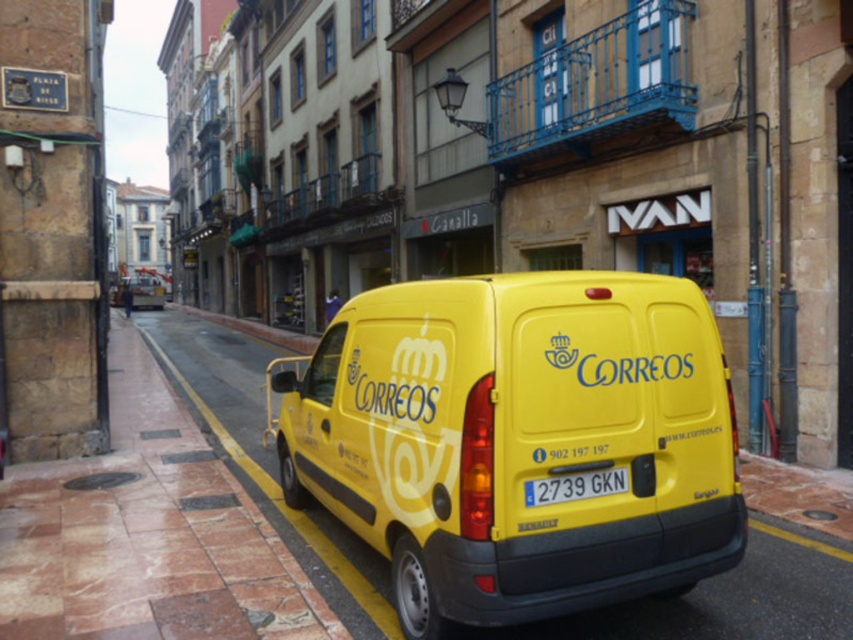
You are a delivery driver who just arrived at this European city street. You need to park your vehicle between the yellow painted curb at lower left and the yellow plastic license plate at center. Is there enough space for your vehicle if it is 2 meters long?

The yellow painted curb at lower left is to the left of yellow plastic license plate at center, but the distance between them is not specified. Without knowing the exact distance, it is impossible to determine if there is enough space for a 2 meter long vehicle.

You are a delivery driver who needs to park your van in this street. The yellow painted curb at lower left is marked as no parking zone. Can you safely park your van at the current position of the yellow matte van at center without violating parking rules?

The yellow matte van at center is smaller than the yellow painted curb at lower left, but the curb is a no parking zone. Therefore, you cannot park there as it violates parking rules.

You are a delivery driver who needs to park your van on the street. The yellow painted curb at lower left and the yellow plastic license plate at center are both visible from your current position. Which object is closer to the ground?

The yellow painted curb at lower left is located below the yellow plastic license plate at center, so it is closer to the ground.